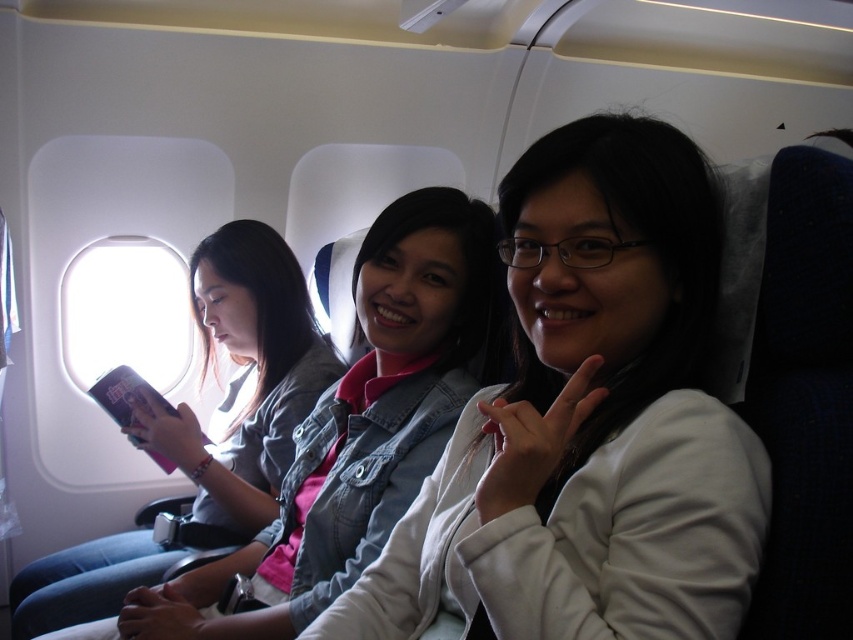
You are a flight attendant checking the overhead compartments. You see the white matte jacket at center and the denim jacket at center. Which jacket can you store in the overhead compartment without folding since it is shorter?

The white matte jacket at center is shorter than the denim jacket at center, so you can store the white matte jacket at center in the overhead compartment without folding.

You are a flight attendant checking seat dimensions for a new passenger. The passenger has a carryon bag that is 18 inches tall. The seat in question has a storage compartment above it. Which object, the white matte jacket at center or the transparent glass airplane window at upper left, is taller and can accommodate the bag?

The white matte jacket at center is much taller than the transparent glass airplane window at upper left, so it can accommodate the 18 inches tall carryon bag.

You are an airline attendant checking seat space. You see the white matte jacket at center and the denim jacket at center. Which jacket takes up more space on the seat?

The denim jacket at center takes up more space because its width is greater than the white matte jacket at center.